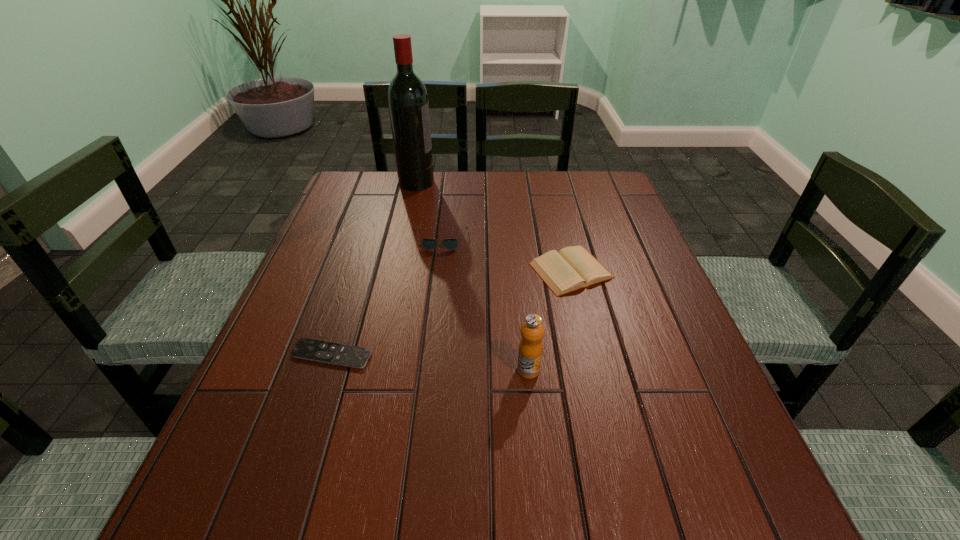
Where is `vacant space at the near left corner`? vacant space at the near left corner is located at coordinates (266, 491).

Where is `vacant space at the far right corner`? The height and width of the screenshot is (540, 960). vacant space at the far right corner is located at coordinates (598, 200).

This screenshot has width=960, height=540. In order to click on vacant space at the near right corner of the desktop in this screenshot , I will do `click(690, 508)`.

Where is `free point between the remote control and the fourth object from left to right`? free point between the remote control and the fourth object from left to right is located at coordinates (430, 362).

You are a GUI agent. You are given a task and a screenshot of the screen. Output one action in this format:
    pyautogui.click(x=<x>, y=<y>)
    Task: Click on the vacant point located between the sunglasses and the farthest object
    This screenshot has height=540, width=960.
    Given the screenshot: What is the action you would take?
    pyautogui.click(x=429, y=211)

In order to click on vacant area that lies between the remote control and the third tallest object in this screenshot , I will do (387, 298).

This screenshot has width=960, height=540. In order to click on unoccupied area between the diary and the wine bottle in this screenshot , I will do `click(493, 226)`.

I want to click on free space between the shortest object and the second tallest object, so click(x=430, y=362).

In order to click on vacant region between the second shortest object and the farthest object in this screenshot , I will do `click(493, 226)`.

Find the location of a particular element. vacant point located between the tallest object and the shortest object is located at coordinates (374, 268).